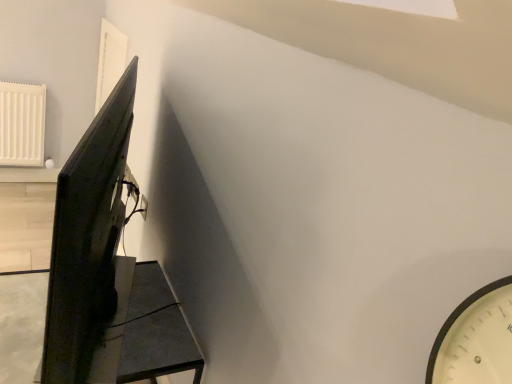
Question: Considering the relative sizes of matte black table at lower left and matte black monitor at left in the image provided, is matte black table at lower left wider than matte black monitor at left?

Choices:
 (A) no
 (B) yes

Answer: (B)

Question: Is matte black table at lower left smaller than matte black monitor at left?

Choices:
 (A) no
 (B) yes

Answer: (A)

Question: Is matte black table at lower left behind matte black monitor at left?

Choices:
 (A) no
 (B) yes

Answer: (B)

Question: Considering the relative sizes of matte black table at lower left and matte black monitor at left in the image provided, is matte black table at lower left taller than matte black monitor at left?

Choices:
 (A) no
 (B) yes

Answer: (A)

Question: Can you confirm if matte black table at lower left is positioned to the right of matte black monitor at left?

Choices:
 (A) no
 (B) yes

Answer: (A)

Question: Based on their sizes in the image, would you say matte black table at lower left is bigger or smaller than white plastic electric outlet at upper center?

Choices:
 (A) small
 (B) big

Answer: (B)

Question: From the image's perspective, is matte black table at lower left located above or below white plastic electric outlet at upper center?

Choices:
 (A) below
 (B) above

Answer: (A)

Question: Considering the relative positions of matte black table at lower left and white plastic electric outlet at upper center in the image provided, is matte black table at lower left to the left or to the right of white plastic electric outlet at upper center?

Choices:
 (A) left
 (B) right

Answer: (A)

Question: In terms of height, does matte black table at lower left look taller or shorter compared to white plastic electric outlet at upper center?

Choices:
 (A) tall
 (B) short

Answer: (A)

Question: Considering the relative positions of matte black table at lower left and matte black monitor at left in the image provided, is matte black table at lower left to the left or to the right of matte black monitor at left?

Choices:
 (A) right
 (B) left

Answer: (B)

Question: From the image's perspective, is matte black table at lower left above or below matte black monitor at left?

Choices:
 (A) below
 (B) above

Answer: (A)

Question: Is matte black table at lower left in front of or behind matte black monitor at left in the image?

Choices:
 (A) behind
 (B) front

Answer: (A)

Question: Is matte black table at lower left bigger or smaller than matte black monitor at left?

Choices:
 (A) small
 (B) big

Answer: (B)

Question: From the image's perspective, is matte black monitor at left positioned above or below white plastic electric outlet at upper center?

Choices:
 (A) above
 (B) below

Answer: (A)

Question: Considering the relative positions of matte black monitor at left and white plastic electric outlet at upper center in the image provided, is matte black monitor at left to the left or to the right of white plastic electric outlet at upper center?

Choices:
 (A) left
 (B) right

Answer: (B)